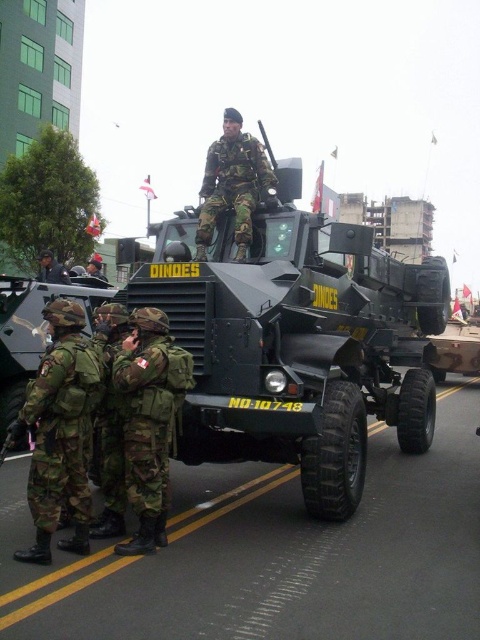
You are a military engineer inspecting the scene. You need to determine if the green matte armored vehicle at center can fit through a narrow passage that is only as wide as the matte black helmet at center. Can it pass through?

The green matte armored vehicle at center is thinner than the matte black helmet at center, so it can pass through the narrow passage since its width is less than the helmet.

You are a military medic carrying a medical kit that is 2 meters wide. You need to move from the camouflage fabric uniform at left to the camouflage fabric uniform at center. Is there enough space between them to move through?

The camouflage fabric uniform at left and camouflage fabric uniform at center are 2.77 meters apart from each other, so yes, the medic can move through the space between them since the distance is greater than the medical kit width.